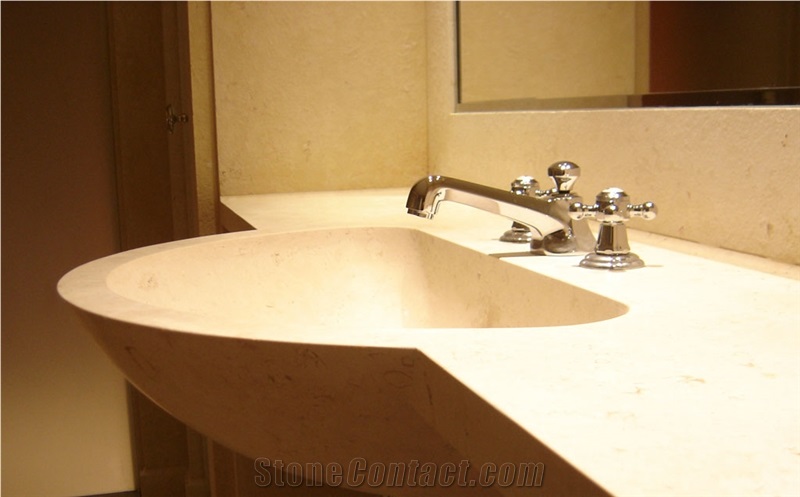
This screenshot has height=497, width=800. Find the location of `basin`. basin is located at coordinates (322, 285).